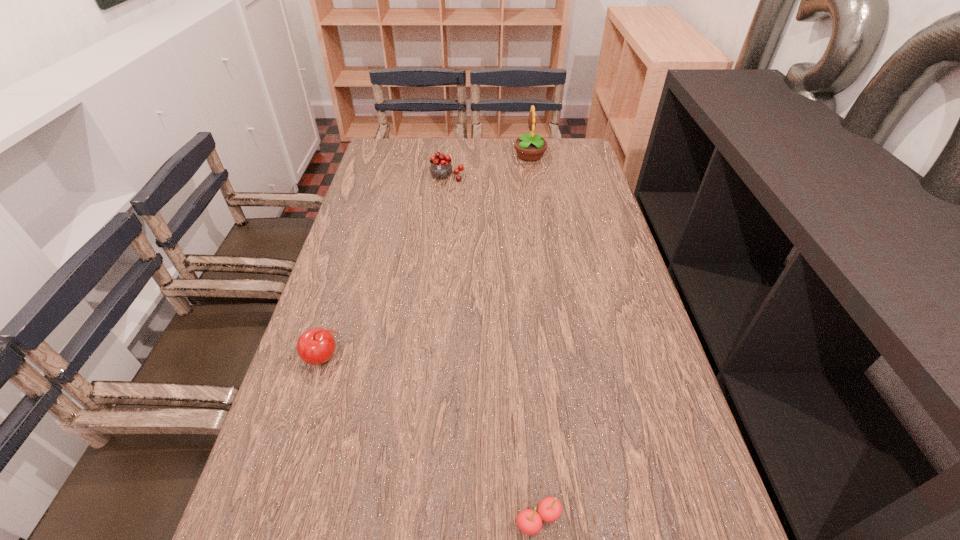
In the image, there is a desktop. Identify the location of vacant area at the left edge. (341, 399).

This screenshot has width=960, height=540. Identify the location of vacant space at the right edge of the desktop. (578, 238).

You are a GUI agent. You are given a task and a screenshot of the screen. Output one action in this format:
    pyautogui.click(x=<x>, y=<y>)
    Task: Click on the vacant region at the far right corner of the desktop
    
    Given the screenshot: What is the action you would take?
    pyautogui.click(x=551, y=158)

Identify the location of free spot between the sunflower and the second farthest object. The height and width of the screenshot is (540, 960). pos(489,166).

The width and height of the screenshot is (960, 540). Find the location of `vacant area that lies between the farthest object and the leftmost object`. vacant area that lies between the farthest object and the leftmost object is located at coordinates (427, 256).

The image size is (960, 540). What are the coordinates of `vacant space in between the sunflower and the leftmost cherry` in the screenshot? It's located at coord(427,256).

This screenshot has width=960, height=540. I want to click on free point between the shortest object and the tallest object, so click(534, 338).

Find the location of `empty space between the second shortest cherry and the rightmost cherry`. empty space between the second shortest cherry and the rightmost cherry is located at coordinates (432, 439).

Image resolution: width=960 pixels, height=540 pixels. What are the coordinates of `empty location between the farthest cherry and the second nearest cherry` in the screenshot? It's located at (386, 267).

The width and height of the screenshot is (960, 540). I want to click on free spot between the farthest object and the rightmost cherry, so click(x=534, y=338).